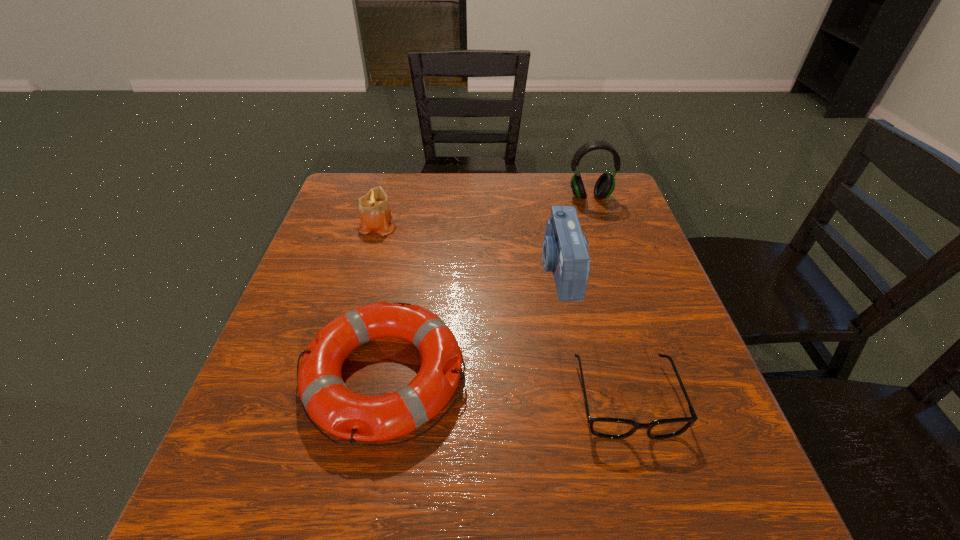
Locate an element on the screen. The width and height of the screenshot is (960, 540). free space between the third nearest object and the candle is located at coordinates (468, 247).

Locate an element on the screen. The width and height of the screenshot is (960, 540). vacant area between the fourth tallest object and the third nearest object is located at coordinates (472, 323).

What are the coordinates of `empty space between the life buoy and the shortest object` in the screenshot? It's located at (505, 387).

Locate an element on the screen. The image size is (960, 540). free space between the shortest object and the third nearest object is located at coordinates (592, 334).

Where is `empty space between the fourth tallest object and the spectacles`? The width and height of the screenshot is (960, 540). empty space between the fourth tallest object and the spectacles is located at coordinates pos(505,387).

Identify which object is the closest to the candle. Please provide its 2D coordinates. Your answer should be formatted as a tuple, i.e. [(x, y)], where the tuple contains the x and y coordinates of a point satisfying the conditions above.

[(329, 403)]

The width and height of the screenshot is (960, 540). Identify the location of object that is the closest one to the tallest object. (565, 249).

Find the location of `vacant area that satisfies the following two spatial constraints: 1. on the ear cups of the farthest object; 2. on the lens of the third farthest object`. vacant area that satisfies the following two spatial constraints: 1. on the ear cups of the farthest object; 2. on the lens of the third farthest object is located at coordinates (613, 269).

You are a GUI agent. You are given a task and a screenshot of the screen. Output one action in this format:
    pyautogui.click(x=<x>, y=<y>)
    Task: Click on the free region that satisfies the following two spatial constraints: 1. on the front side of the second shortest object; 2. on the left side of the candle
    This screenshot has width=960, height=540.
    Given the screenshot: What is the action you would take?
    pyautogui.click(x=335, y=376)